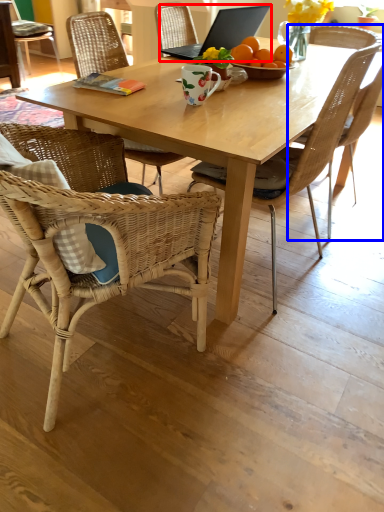
Question: Which of the following is the farthest to the observer, laptop (highlighted by a red box) or chair (highlighted by a blue box)?

Choices:
 (A) laptop
 (B) chair

Answer: (A)